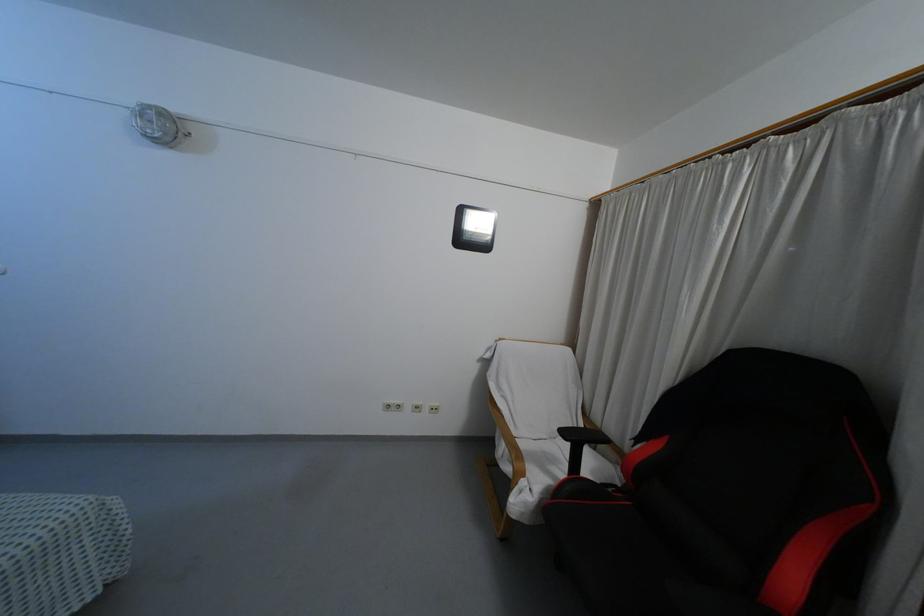
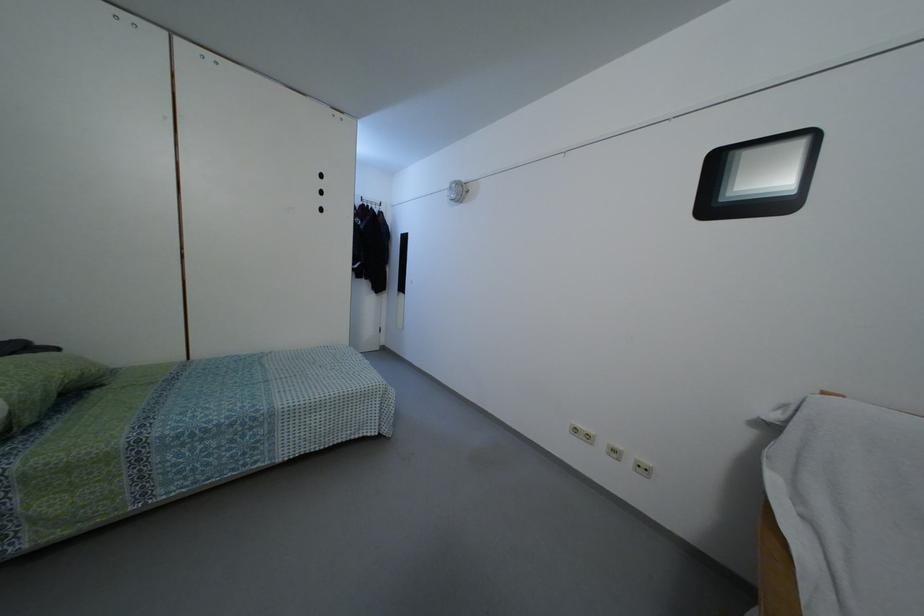
Find the pixel in the second image that matches (417,410) in the first image.

(614, 456)